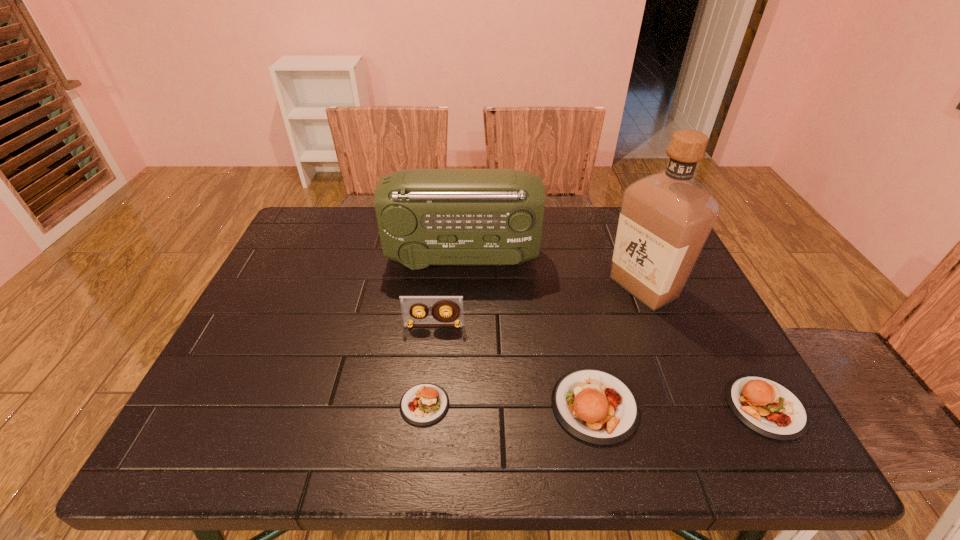
Locate an element on the screen. free point located 0.390m on the back of the second patty (food) from right to left is located at coordinates point(562,259).

You are a GUI agent. You are given a task and a screenshot of the screen. Output one action in this format:
    pyautogui.click(x=<x>, y=<y>)
    Task: Click on the vacant region located 0.160m on the back of the rightmost patty (food)
    The image size is (960, 540).
    Given the screenshot: What is the action you would take?
    pyautogui.click(x=718, y=322)

Find the location of a particular element. blank space located on the front-facing side of the radio_receiver is located at coordinates (571, 259).

At what (x,y) coordinates should I click in order to perform the action: click on vacant space located 0.160m at the front of the third tallest object with visible reels. Please return your answer as a coordinate pair (x, y). The image size is (960, 540). Looking at the image, I should click on (427, 384).

At what (x,y) coordinates should I click in order to perform the action: click on vacant space positioned 0.190m on the front-facing side of the liquor. Please return your answer as a coordinate pair (x, y). This screenshot has width=960, height=540. Looking at the image, I should click on (535, 287).

Where is `vacant region located on the front-facing side of the liquor`? The height and width of the screenshot is (540, 960). vacant region located on the front-facing side of the liquor is located at coordinates (505, 287).

Where is `vacant space situated 0.070m on the front-facing side of the liquor`? The image size is (960, 540). vacant space situated 0.070m on the front-facing side of the liquor is located at coordinates (581, 287).

Identify the location of object present at the far edge. The height and width of the screenshot is (540, 960). (426, 217).

At what (x,y) coordinates should I click in order to perform the action: click on patty (food) at the right edge. Please return your answer as a coordinate pair (x, y). This screenshot has width=960, height=540. Looking at the image, I should click on (767, 407).

Locate an element on the screen. liquor that is at the right edge is located at coordinates (665, 219).